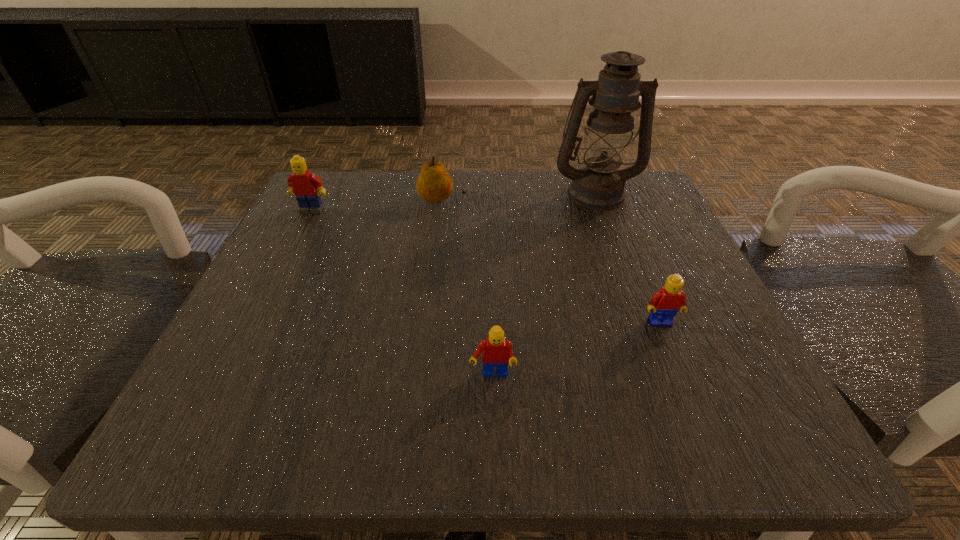
Identify the location of object present at the far right corner. [x=599, y=185].

The height and width of the screenshot is (540, 960). In the image, there is a desktop. What are the coordinates of `vacant space at the far edge` in the screenshot? It's located at (459, 177).

I want to click on vacant space at the left edge, so click(337, 253).

Where is `blank space at the right edge`? blank space at the right edge is located at coordinates (677, 314).

You are a GUI agent. You are given a task and a screenshot of the screen. Output one action in this format:
    pyautogui.click(x=<x>, y=<y>)
    Task: Click on the vacant space at the far left corner
    The height and width of the screenshot is (540, 960).
    Given the screenshot: What is the action you would take?
    pyautogui.click(x=340, y=198)

This screenshot has width=960, height=540. What are the coordinates of `vacant space at the far right corner of the desktop` in the screenshot? It's located at (654, 227).

Find the location of a particular element. The height and width of the screenshot is (540, 960). vacant area that lies between the third object from right to left and the fourth object from right to left is located at coordinates (468, 288).

In order to click on unoccupied area between the pear and the tallest object in this screenshot , I will do `click(519, 196)`.

Identify the location of free space between the oil lamp and the nearest Lego. The width and height of the screenshot is (960, 540). (544, 284).

Find the location of a particular element. This screenshot has height=540, width=960. free space between the fourth object from right to left and the second nearest object is located at coordinates (551, 261).